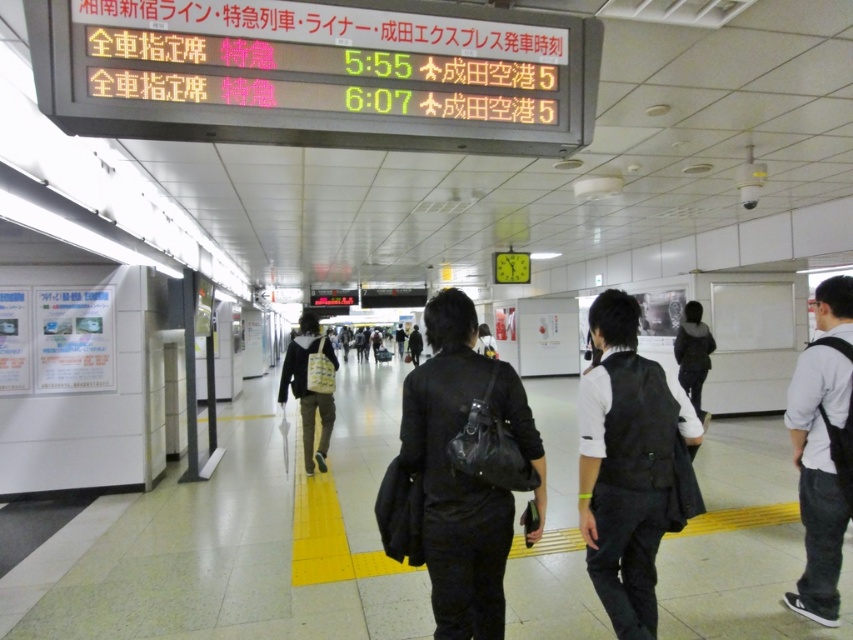
Between white cotton shirt at right and white fabric bag at center, which one is positioned higher?

white cotton shirt at right

Does white cotton shirt at right lie in front of white fabric bag at center?

Yes, it is.

At what (x,y) coordinates should I click in order to perform the action: click on white cotton shirt at right. Please return your answer as a coordinate pair (x, y). Looking at the image, I should click on (817, 476).

Is black textured vest at center wider than white fabric bag at center?

Correct, the width of black textured vest at center exceeds that of white fabric bag at center.

Is point (671, 387) more distant than point (322, 458)?

No, (671, 387) is closer to viewer.

Does point (635, 307) come closer to viewer compared to point (318, 408)?

Yes, it is.

Where is `black textured vest at center`? The height and width of the screenshot is (640, 853). black textured vest at center is located at coordinates (625, 464).

Can you confirm if black matte bag at center is shorter than white cotton shirt at right?

Yes.

Locate an element on the screen. This screenshot has height=640, width=853. black matte bag at center is located at coordinates 457,476.